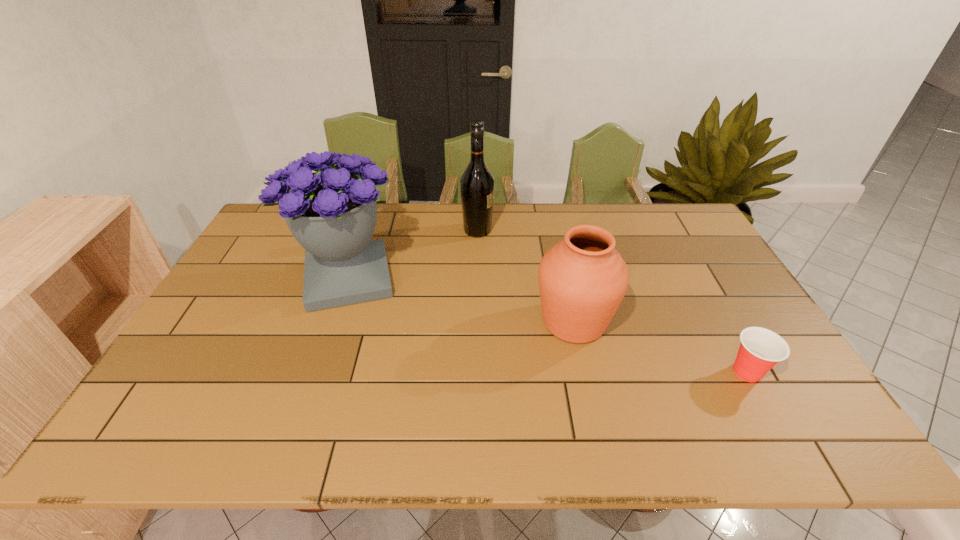
Locate an element on the screen. Image resolution: width=960 pixels, height=540 pixels. blank area located on the left of the rightmost object is located at coordinates (693, 372).

At what (x,y) coordinates should I click in order to perform the action: click on object at the far edge. Please return your answer as a coordinate pair (x, y). This screenshot has height=540, width=960. Looking at the image, I should click on (477, 183).

Locate an element on the screen. The width and height of the screenshot is (960, 540). object at the right edge is located at coordinates (760, 350).

Identify the location of free location at the far edge. (628, 224).

Where is `free region at the near edge of the desktop`? The image size is (960, 540). free region at the near edge of the desktop is located at coordinates (562, 420).

Find the location of a particular element. vacant space at the left edge of the desktop is located at coordinates (261, 269).

At what (x,y) coordinates should I click in order to perform the action: click on free space at the right edge of the desktop. Please return your answer as a coordinate pair (x, y). The height and width of the screenshot is (540, 960). Looking at the image, I should click on (717, 313).

Where is `vacant space at the far right corner of the desktop`? vacant space at the far right corner of the desktop is located at coordinates (673, 228).

Identify the location of free space between the urn and the third object from right to left. coord(526,276).

The image size is (960, 540). Identify the location of vacant area that lies between the second object from right to left and the nearest object. (660, 347).